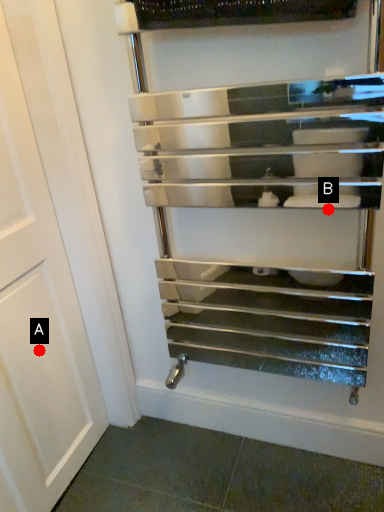
Question: Two points are circled on the image, labeled by A and B beside each circle. Which point is farther from the camera taking this photo?

Choices:
 (A) A is further
 (B) B is further

Answer: (A)